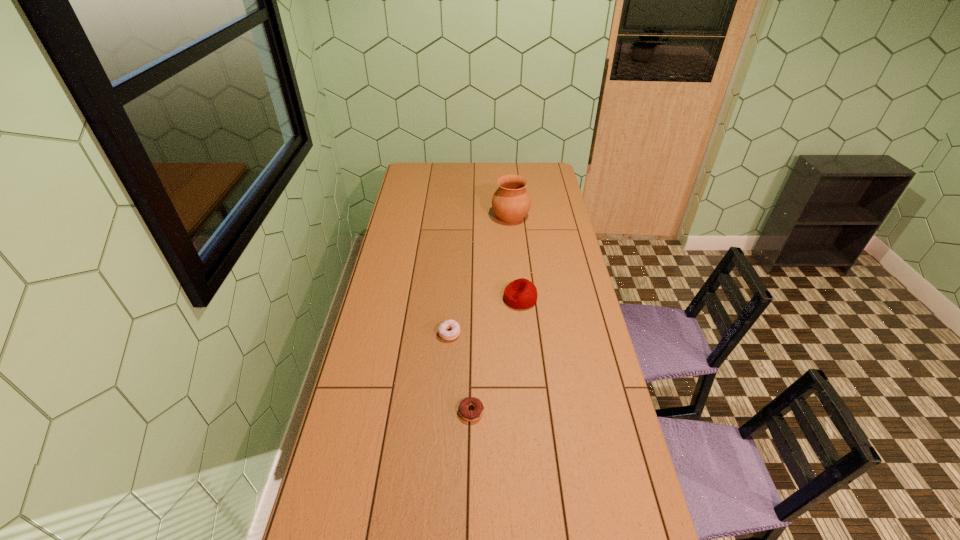
Identify the location of the farthest object. This screenshot has width=960, height=540. (511, 202).

Locate an element on the screen. the tallest object is located at coordinates (511, 202).

This screenshot has width=960, height=540. What are the coordinates of `beanbag` in the screenshot? It's located at (521, 293).

The width and height of the screenshot is (960, 540). I want to click on the third nearest object, so click(x=521, y=293).

Locate an element on the screen. the third farthest object is located at coordinates (448, 324).

This screenshot has height=540, width=960. In order to click on the second shortest object in this screenshot , I will do `click(448, 324)`.

This screenshot has height=540, width=960. In order to click on the nearest object in this screenshot , I will do `click(466, 414)`.

Find the location of a particular element. This screenshot has width=960, height=540. the nearer doughnut is located at coordinates (466, 414).

Where is `free space located 0.120m on the back of the pottery`? free space located 0.120m on the back of the pottery is located at coordinates (509, 194).

Where is `vacant space positioned on the seat area of the beanbag`? The height and width of the screenshot is (540, 960). vacant space positioned on the seat area of the beanbag is located at coordinates (431, 299).